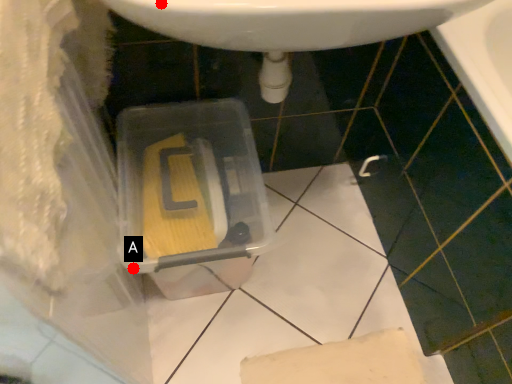
Question: Two points are circled on the image, labeled by A and B beside each circle. Which point is farther to the camera?

Choices:
 (A) A is further
 (B) B is further

Answer: (A)